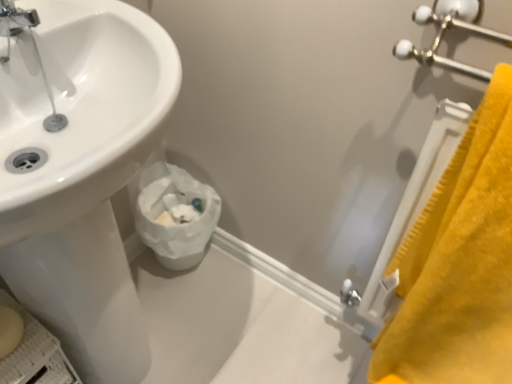
Find the location of a particular element. free space to the right of chrome metallic faucet at upper left is located at coordinates (103, 20).